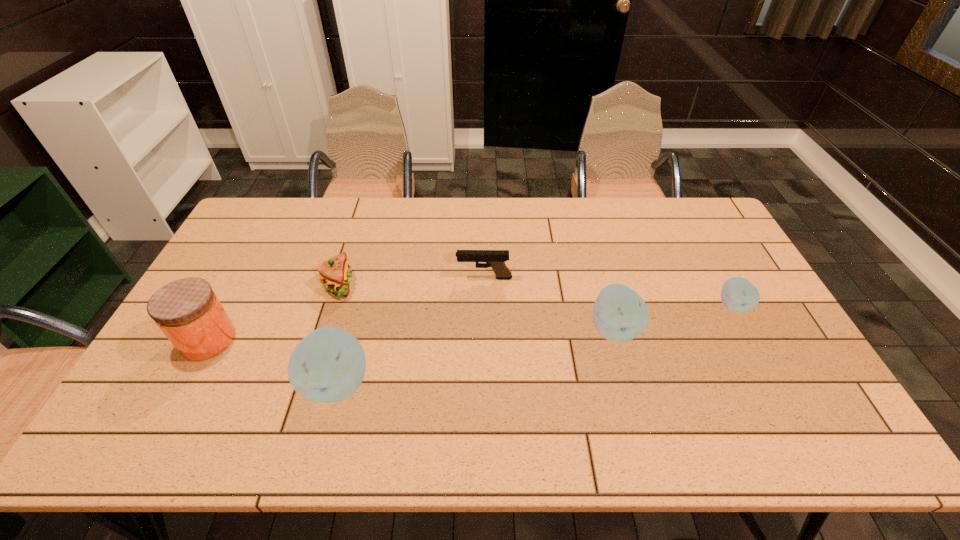
In order to click on the leftmost apple in this screenshot , I will do `click(328, 365)`.

Identify the location of the second apple from right to left. (619, 314).

Find the location of a particular element. The width and height of the screenshot is (960, 540). the second shortest apple is located at coordinates click(619, 314).

The width and height of the screenshot is (960, 540). What are the coordinates of `the shortest apple` in the screenshot? It's located at (738, 295).

The width and height of the screenshot is (960, 540). Find the location of `the rightmost object`. the rightmost object is located at coordinates (738, 295).

Locate an element on the screen. the leftmost object is located at coordinates (188, 312).

Image resolution: width=960 pixels, height=540 pixels. What are the coordinates of `sandwich` in the screenshot? It's located at (335, 274).

Where is `pistol`? The image size is (960, 540). pistol is located at coordinates (496, 259).

The width and height of the screenshot is (960, 540). Find the location of `vacant point located 0.200m on the back of the leftmost apple`. vacant point located 0.200m on the back of the leftmost apple is located at coordinates (359, 300).

You are a GUI agent. You are given a task and a screenshot of the screen. Output one action in this format:
    pyautogui.click(x=<x>, y=<y>)
    Task: Click on the blank space located 0.060m on the front of the second shortest apple
    
    Given the screenshot: What is the action you would take?
    pyautogui.click(x=624, y=368)